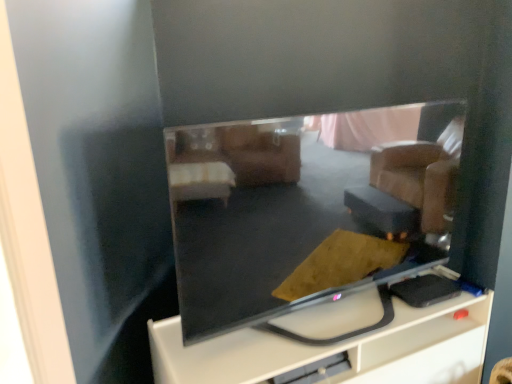
In order to face matte black tv at center, should I rotate leftwards or rightwards?

Rotate your view right by about 10.390°.

This screenshot has width=512, height=384. What do you see at coordinates (305, 210) in the screenshot?
I see `matte black tv at center` at bounding box center [305, 210].

Where is `matte black tv at center`? The height and width of the screenshot is (384, 512). matte black tv at center is located at coordinates (305, 210).

Describe the element at coordinates (337, 349) in the screenshot. I see `matte black tv at center` at that location.

What is the approximate height of matte black tv at center?

matte black tv at center is 61.10 centimeters in height.

Find the location of a particular element. Image resolution: width=512 pixels, height=384 pixels. matte black tv at center is located at coordinates (337, 349).

This screenshot has width=512, height=384. I want to click on matte black tv at center, so click(305, 210).

Would you say matte black tv at center is to the left or to the right of matte black tv at center in the picture?

Clearly, matte black tv at center is on the right of matte black tv at center in the image.

From the picture: Considering the relative positions of matte black tv at center and matte black tv at center in the image provided, is matte black tv at center in front of matte black tv at center?

No, the depth of matte black tv at center is greater than that of matte black tv at center.

Is point (462, 326) positioned behind point (339, 154)?

Yes, it is.

From the image's perspective, is matte black tv at center positioned above or below matte black tv at center?

matte black tv at center is situated lower than matte black tv at center in the image.

From a real-world perspective, who is located higher, matte black tv at center or matte black tv at center?

matte black tv at center, from a real-world perspective.

Is matte black tv at center wider or thinner than matte black tv at center?

Considering their sizes, matte black tv at center looks broader than matte black tv at center.

Can you confirm if matte black tv at center is taller than matte black tv at center?

No.

Is matte black tv at center smaller than matte black tv at center?

No, matte black tv at center is not smaller than matte black tv at center.

Is matte black tv at center not within matte black tv at center?

matte black tv at center lies outside matte black tv at center's area.

Can you see matte black tv at center touching matte black tv at center?

No, matte black tv at center is not beside matte black tv at center.

Is matte black tv at center aimed at matte black tv at center?

No, matte black tv at center is not oriented towards matte black tv at center.

How different are the orientations of matte black tv at center and matte black tv at center in degrees?

The angle between the facing direction of matte black tv at center and the facing direction of matte black tv at center is 2.35 degrees.

Locate an element on the screen. Image resolution: width=512 pixels, height=384 pixels. television on the left of matte black tv at center is located at coordinates (305, 210).

In the image, is matte black tv at center on the left side or the right side of matte black tv at center?

Based on their positions, matte black tv at center is located to the left of matte black tv at center.

Considering the positions of objects matte black tv at center and matte black tv at center in the image provided, who is behind, matte black tv at center or matte black tv at center?

matte black tv at center.

Which is farther from the camera, (x=276, y=121) or (x=386, y=355)?

The point (x=386, y=355) is behind.

From the image's perspective, does matte black tv at center appear higher than matte black tv at center?

Yes.

From a real-world perspective, is matte black tv at center on matte black tv at center?

Yes.

In terms of width, does matte black tv at center look wider or thinner when compared to matte black tv at center?

matte black tv at center is thinner than matte black tv at center.

In the scene shown: Considering the sizes of objects matte black tv at center and matte black tv at center in the image provided, who is taller, matte black tv at center or matte black tv at center?

Standing taller between the two is matte black tv at center.

Does matte black tv at center have a smaller size compared to matte black tv at center?

Yes, matte black tv at center is smaller than matte black tv at center.

Is matte black tv at center inside the boundaries of matte black tv at center, or outside?

matte black tv at center is not inside matte black tv at center, it's outside.

Are matte black tv at center and matte black tv at center far apart?

No.

Does matte black tv at center turn towards matte black tv at center?

No, matte black tv at center is not aimed at matte black tv at center.

What's the angular difference between matte black tv at center and matte black tv at center's facing directions?

There is a 2.35-degree angle between the facing directions of matte black tv at center and matte black tv at center.

The width and height of the screenshot is (512, 384). Identify the location of furniture lying on the right of matte black tv at center. (337, 349).

This screenshot has width=512, height=384. What are the coordinates of `television on the left of matte black tv at center` in the screenshot? It's located at (305, 210).

The height and width of the screenshot is (384, 512). In order to click on furniture lying on the right of matte black tv at center in this screenshot , I will do `click(337, 349)`.